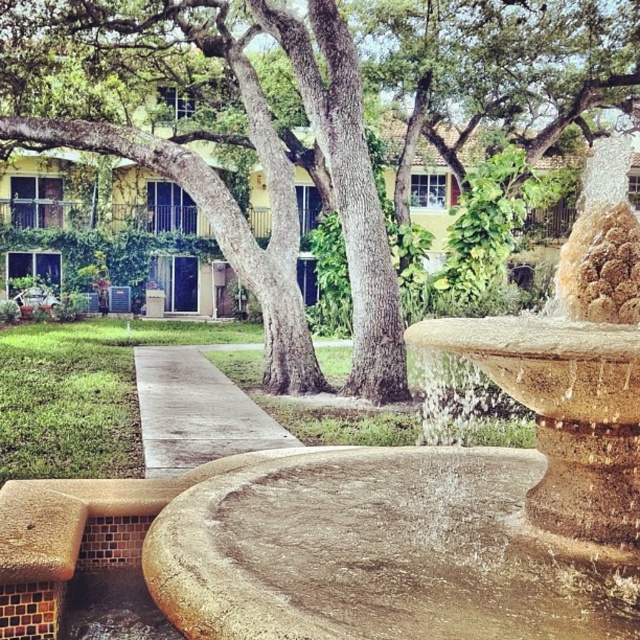
Is point (438, 497) farther from viewer compared to point (285, 36)?

That is False.

Can you confirm if stone fountain at center is positioned below green textured tree at center?

Indeed, stone fountain at center is positioned under green textured tree at center.

Where is `stone fountain at center`? The width and height of the screenshot is (640, 640). stone fountain at center is located at coordinates (444, 486).

Is stone fountain at center closer to the viewer compared to concrete at center?

Yes.

Between point (209, 525) and point (244, 442), which one is positioned in front?

Point (209, 525) is more forward.

You are a GUI agent. You are given a task and a screenshot of the screen. Output one action in this format:
    pyautogui.click(x=<x>, y=<y>)
    Task: Click on the stone fountain at center
    Image resolution: width=640 pixels, height=640 pixels.
    Given the screenshot: What is the action you would take?
    [x=444, y=486]

Between green textured tree at center and concrete at center, which one is positioned lower?

concrete at center is below.

Is point (291, 17) farther from viewer compared to point (234, 385)?

Yes.

Between point (243, 262) and point (180, 403), which one is positioned in front?

Point (180, 403) is more forward.

Find the location of a particular element. green textured tree at center is located at coordinates (259, 156).